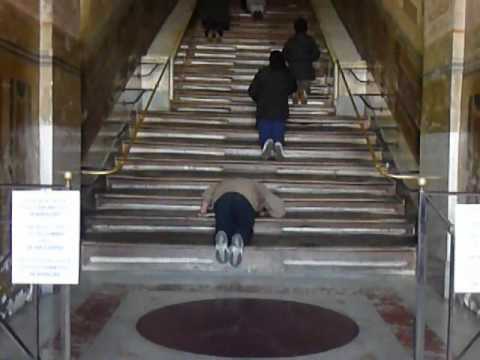
What are the coordinates of `left wall` in the screenshot? It's located at (103, 44).